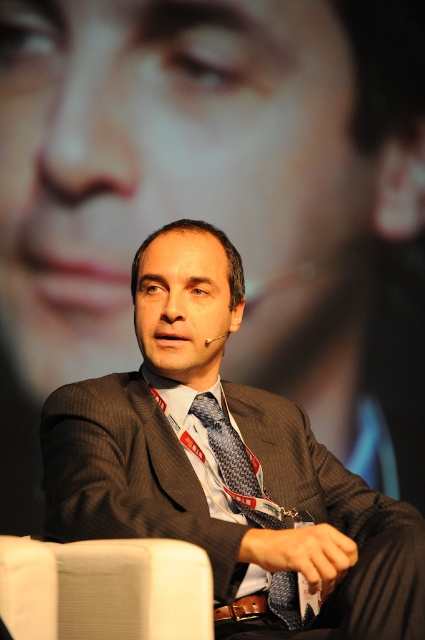
You are attending a virtual conference and notice the man in the image. Based on the scene, can you determine if the matte gray suit at center is positioned higher than the patterned silk tie at center?

The matte gray suit at center is above the patterned silk tie at center, so yes, the matte gray suit at center is positioned higher than the patterned silk tie at center.

You are a photographer positioned at the origin point in the room. You need to capture a photo of the matte gray suit at center. What are the coordinates where you should aim your camera?

The coordinates to aim your camera are at point (226, 467).

You are an event organizer checking the seating arrangement for the upcoming panel discussion. You need to ensure that the matte gray suit at center and the white fabric chair at lower left will fit side by side on a stage. Based on the image provided, will they fit if the total available space is 1.5 meters wide?

The matte gray suit at center is wider than the white fabric chair at lower left. Since the total available space is 1.5 meters, and the combined width of both items exceeds this measurement, they will not fit side by side within the given space.